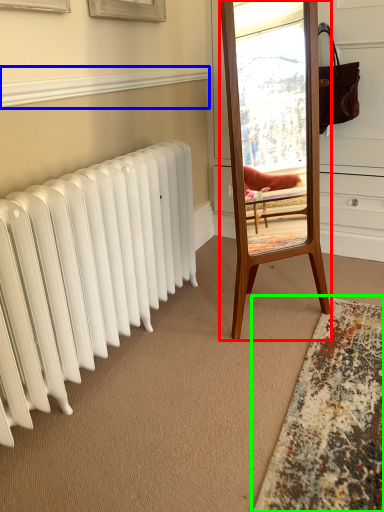
Question: Estimate the real-world distances between objects in this image. Which object is farther from mirror (highlighted by a red box), window sill (highlighted by a blue box) or mat (highlighted by a green box)?

Choices:
 (A) window sill
 (B) mat

Answer: (A)